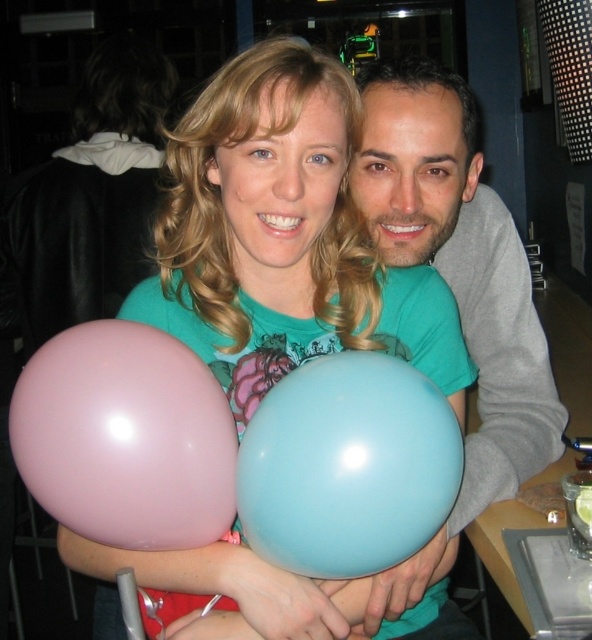
Based on the photo, who is more forward, (227, 344) or (226, 406)?

Point (226, 406) is in front.

Consider the image. Measure the distance between matte rubber balloons at center and pink rubber balloon at left.

A distance of 18.11 centimeters exists between matte rubber balloons at center and pink rubber balloon at left.

Locate an element on the screen. matte rubber balloons at center is located at coordinates (284, 236).

Between matte rubber balloons at center and light blue rubber balloon at center, which one appears on the left side from the viewer's perspective?

Positioned to the left is matte rubber balloons at center.

Which is more to the right, matte rubber balloons at center or light blue rubber balloon at center?

light blue rubber balloon at center is more to the right.

Is point (271, 81) behind point (343, 524)?

Yes, it is.

Identify the location of matte rubber balloons at center. (284, 236).

Which of these two, pink rubber balloon at left or light blue rubber balloon at center, stands taller?

With more height is pink rubber balloon at left.

Can you confirm if pink rubber balloon at left is shorter than light blue rubber balloon at center?

Incorrect, pink rubber balloon at left's height does not fall short of light blue rubber balloon at center's.

You are a GUI agent. You are given a task and a screenshot of the screen. Output one action in this format:
    pyautogui.click(x=<x>, y=<y>)
    Task: Click on the pink rubber balloon at left
    This screenshot has height=640, width=592.
    Given the screenshot: What is the action you would take?
    pyautogui.click(x=126, y=436)